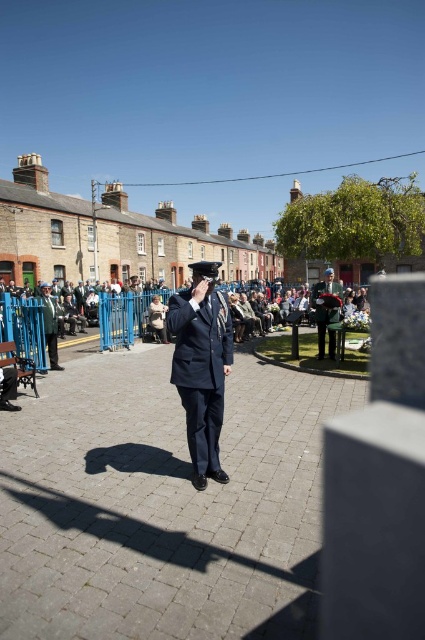
Is dark blue uniform at center bigger than matte black uniform at center?

Indeed, dark blue uniform at center has a larger size compared to matte black uniform at center.

Is dark blue uniform at center further to camera compared to matte black uniform at center?

No, dark blue uniform at center is in front of matte black uniform at center.

Is point (221, 385) positioned after point (57, 324)?

No, (221, 385) is in front of (57, 324).

The width and height of the screenshot is (425, 640). I want to click on dark blue uniform at center, so click(201, 365).

Measure the distance between green uniform at center and camera.

They are 15.43 meters apart.

Does green uniform at center appear under matte black uniform at center?

No, green uniform at center is not below matte black uniform at center.

Locate an element on the screen. The height and width of the screenshot is (640, 425). green uniform at center is located at coordinates (325, 305).

Between dark blue uniform at center and green uniform at center, which one is positioned higher?

dark blue uniform at center is higher up.

Between point (201, 304) and point (328, 284), which one is positioned behind?

The point (328, 284) is more distant.

Locate an element on the screen. dark blue uniform at center is located at coordinates (201, 365).